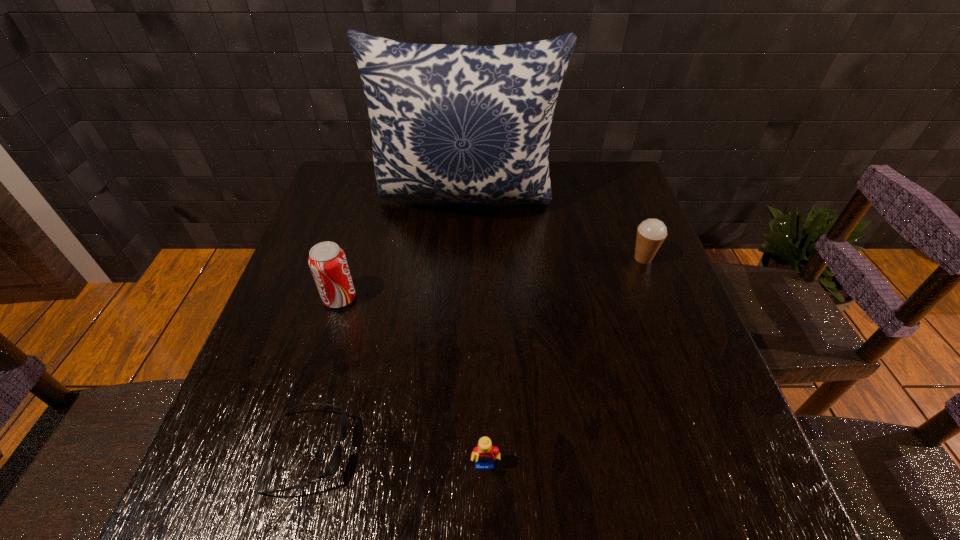
The height and width of the screenshot is (540, 960). What are the coordinates of `free space located on the back of the second farthest object` in the screenshot? It's located at (620, 199).

The width and height of the screenshot is (960, 540). Find the location of `free location located on the front-facing side of the sunglasses`. free location located on the front-facing side of the sunglasses is located at coordinates (388, 452).

This screenshot has height=540, width=960. Find the location of `object at the far edge`. object at the far edge is located at coordinates (461, 123).

At what (x,y) coordinates should I click in order to perform the action: click on Lego positioned at the near edge. Please return your answer as a coordinate pair (x, y). The height and width of the screenshot is (540, 960). Looking at the image, I should click on (484, 453).

Find the location of a particular element. sunglasses that is at the near edge is located at coordinates [334, 464].

Locate an element on the screen. Image resolution: width=960 pixels, height=540 pixels. cushion positioned at the left edge is located at coordinates coord(461,123).

Locate an element on the screen. This screenshot has width=960, height=540. soda can that is positioned at the left edge is located at coordinates (x=327, y=261).

Image resolution: width=960 pixels, height=540 pixels. In order to click on sunglasses that is at the left edge in this screenshot , I will do `click(334, 464)`.

Identify the location of object that is at the right edge. (651, 233).

The width and height of the screenshot is (960, 540). Find the location of `object present at the far left corner`. object present at the far left corner is located at coordinates (461, 123).